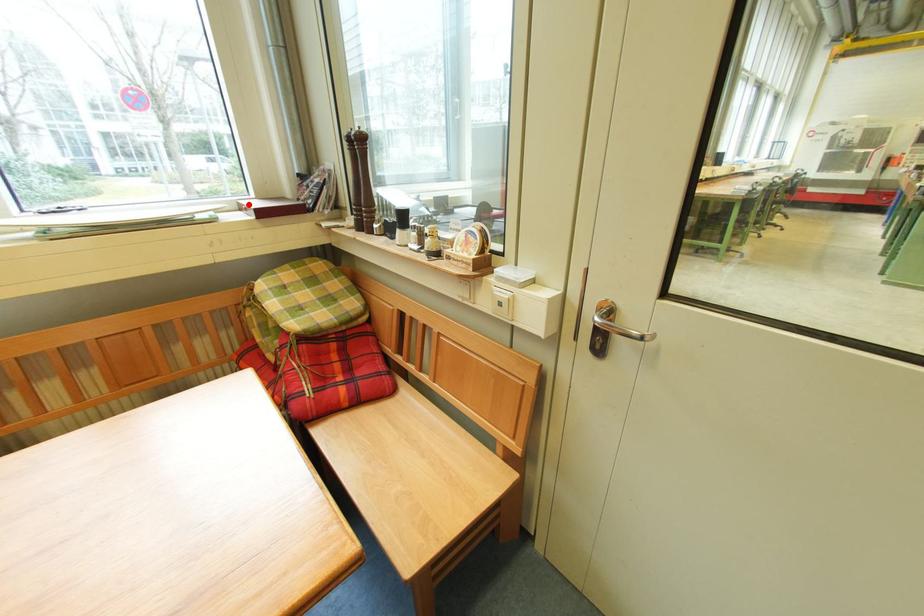
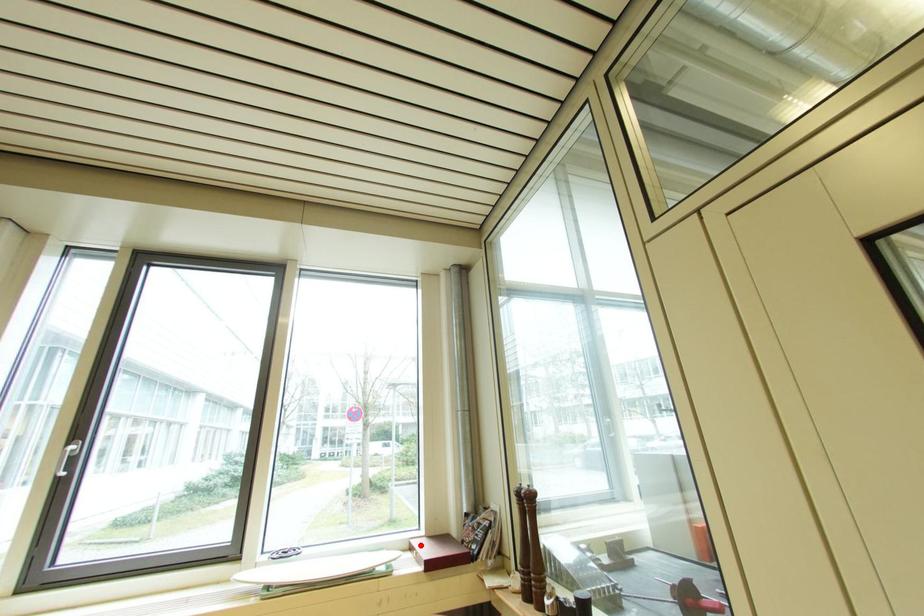
I am providing you with two images of the same scene from different viewpoints. A red point is marked on the first image and another point is marked on the second image. Do the highlighted points in image1 and image2 indicate the same real-world spot?

Yes